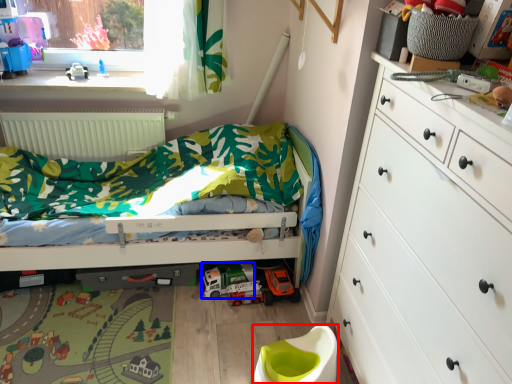
Question: Which of the following is the farthest to the observer, toilet bowl (highlighted by a red box) or toy car (highlighted by a blue box)?

Choices:
 (A) toilet bowl
 (B) toy car

Answer: (B)